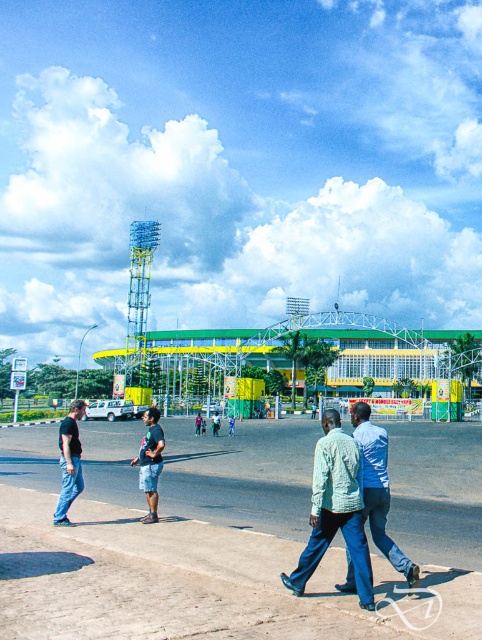
You are standing at the point marked as point [347,522] in the image. The distance from you to the viewer is 5.85 meters. If you want to walk towards the modern building with a curved roof, which direction should you move relative to your current position?

Since the modern building with a curved roof is in the midground, you should move forward from your current position at point [347,522] towards the building. The distance of 5.85 meters indicates you are relatively close and facing towards the building, so moving forward would be the correct direction.

You are a delivery robot with a package that requires a 30 inch clearance to pass between two people. You need to navigate through the paved area where the light green fabric jacket at center and the light blue denim pants at center are standing. Can you safely pass between them?

The distance between the light green fabric jacket at center and the light blue denim pants at center is 29.04 inches, which is less than the required 30 inch clearance. Therefore, the delivery robot cannot safely pass between them.

You are standing at the viewpoint of the image and want to walk towards the two points marked in the scene. Which point, point (379, 467) or point (66, 506), will you reach first?

Point (379, 467) is closer to the viewer than point (66, 506), so you will reach point (379, 467) first.